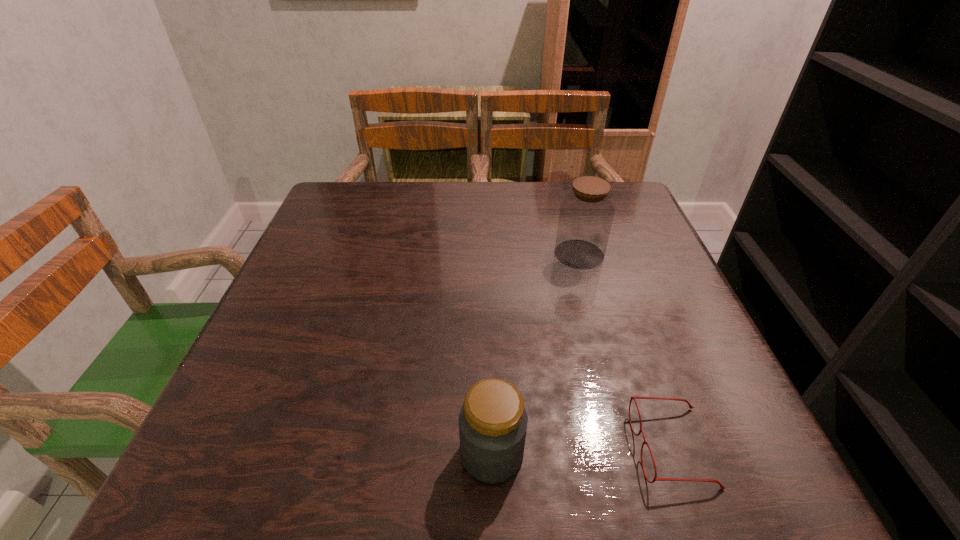
Locate an element on the screen. This screenshot has height=540, width=960. free spot located 0.400m on the face of the spectacles is located at coordinates (370, 447).

Where is `vacant region located 0.150m on the face of the spectacles`? This screenshot has height=540, width=960. vacant region located 0.150m on the face of the spectacles is located at coordinates (536, 447).

Where is `jar that is positioned at the near edge`? The image size is (960, 540). jar that is positioned at the near edge is located at coordinates (493, 421).

Where is `spectacles present at the near edge`? The height and width of the screenshot is (540, 960). spectacles present at the near edge is located at coordinates (632, 397).

You are a GUI agent. You are given a task and a screenshot of the screen. Output one action in this format:
    pyautogui.click(x=<x>, y=<y>)
    Task: Click on the jar present at the right edge
    This screenshot has height=540, width=960.
    Given the screenshot: What is the action you would take?
    pyautogui.click(x=586, y=214)

Identify the location of spectacles that is at the right edge. The width and height of the screenshot is (960, 540). (632, 397).

This screenshot has width=960, height=540. I want to click on object at the near right corner, so click(632, 397).

Find the location of a particular element. The width and height of the screenshot is (960, 540). free spot at the far edge of the desktop is located at coordinates (467, 187).

The height and width of the screenshot is (540, 960). What are the coordinates of `free space at the near edge` in the screenshot? It's located at (380, 472).

Image resolution: width=960 pixels, height=540 pixels. I want to click on free space at the left edge of the desktop, so click(280, 377).